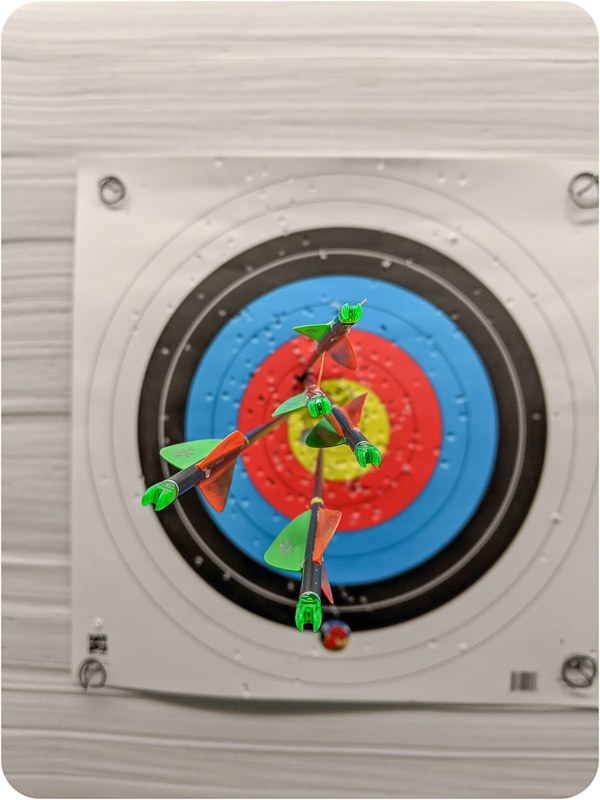
Where is `darts`? This screenshot has width=600, height=800. darts is located at coordinates (309, 590), (176, 488), (317, 408), (368, 453), (343, 321).